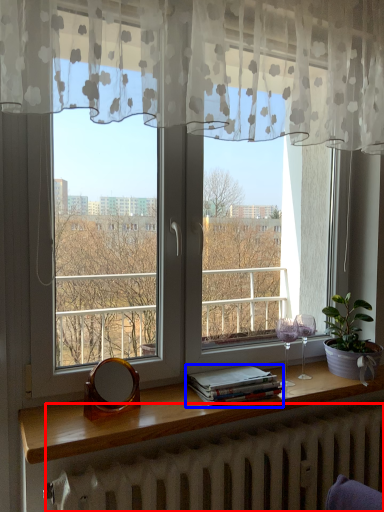
Question: Which object is closer to the camera taking this photo, radiator (highlighted by a red box) or book (highlighted by a blue box)?

Choices:
 (A) radiator
 (B) book

Answer: (A)